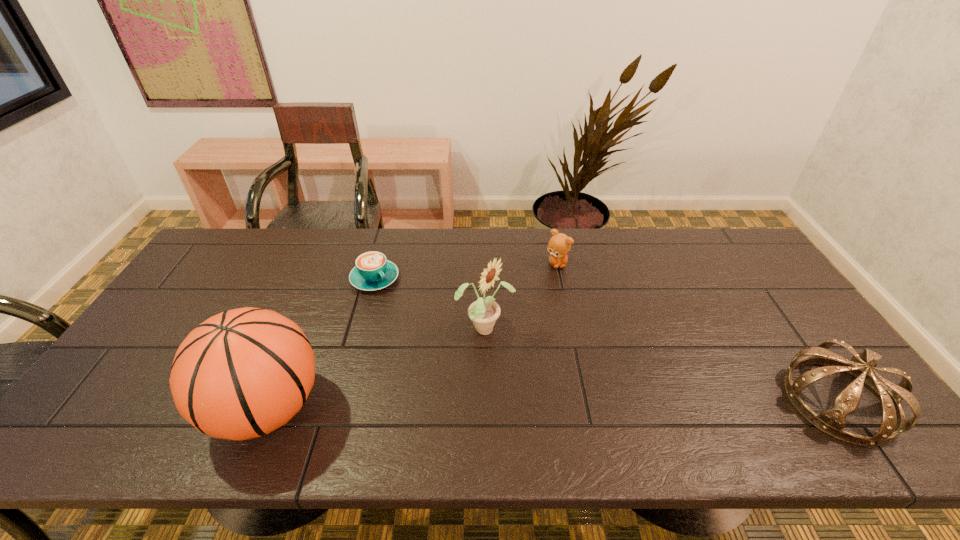
Find the location of a particular element. The image size is (960, 540). vacant area between the tiara and the sunflower is located at coordinates (661, 365).

Identify the location of vacant space that's between the basketball and the second object from right to left. (412, 336).

I want to click on blank region between the basketball and the sunflower, so click(x=376, y=369).

Find the location of a particular element. free space between the shortest object and the second object from right to left is located at coordinates (466, 271).

I want to click on free spot between the second object from right to left and the basketball, so click(412, 336).

Where is `unoccupied position between the cappuccino and the third shortest object`? unoccupied position between the cappuccino and the third shortest object is located at coordinates (607, 340).

Where is `free space between the third object from left to right and the basketball`? The height and width of the screenshot is (540, 960). free space between the third object from left to right and the basketball is located at coordinates [376, 369].

In order to click on free spot between the fourth object from left to right and the sunflower in this screenshot , I will do `click(521, 296)`.

The height and width of the screenshot is (540, 960). In order to click on unoccupied area between the basketball and the shortest object in this screenshot , I will do `click(321, 343)`.

Where is `the fourth closest object to the third object from right to left`? the fourth closest object to the third object from right to left is located at coordinates (832, 421).